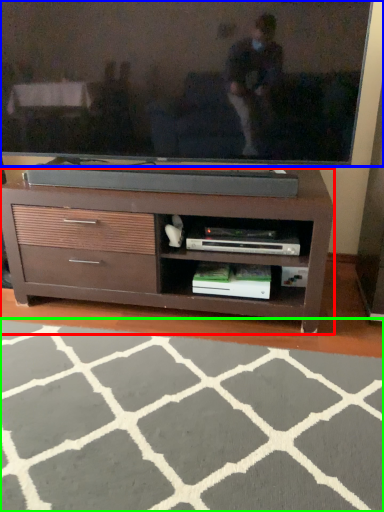
Question: Based on their relative distances, which object is nearer to chest of drawers (highlighted by a red box)? Choose from television (highlighted by a blue box) and plain (highlighted by a green box).

Choices:
 (A) television
 (B) plain

Answer: (A)